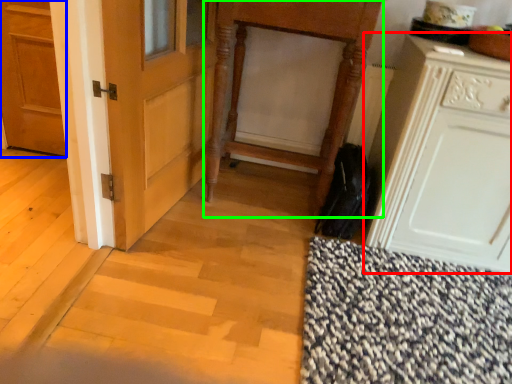
Question: Estimate the real-world distances between objects in this image. Which object is closer to cabinetry (highlighted by a red box), door (highlighted by a blue box) or vanity (highlighted by a green box)?

Choices:
 (A) door
 (B) vanity

Answer: (B)